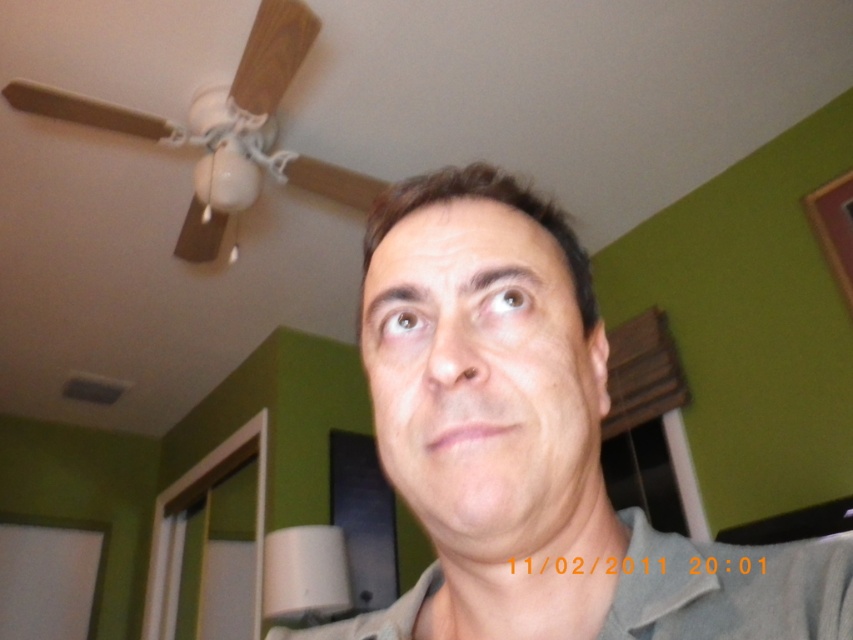
You are a photographer adjusting your camera settings. You notice the gray matte shirt at center and the smooth skin face at center in your frame. Which object is wider in the current composition?

The gray matte shirt at center is wider than the smooth skin face at center.

You are a photographer adjusting the camera focus. You notice a point at coordinates [532,445] on the image. What object is located at that point?

The point at coordinates [532,445] marks the gray matte shirt at center.

Based on the photo, you are a photographer adjusting your camera settings. You notice the gray matte shirt at center and the smooth skin face at center in your viewfinder. Which object is positioned to the left when viewed from the photographer perspective?

The gray matte shirt at center is to the left of the smooth skin face at center.